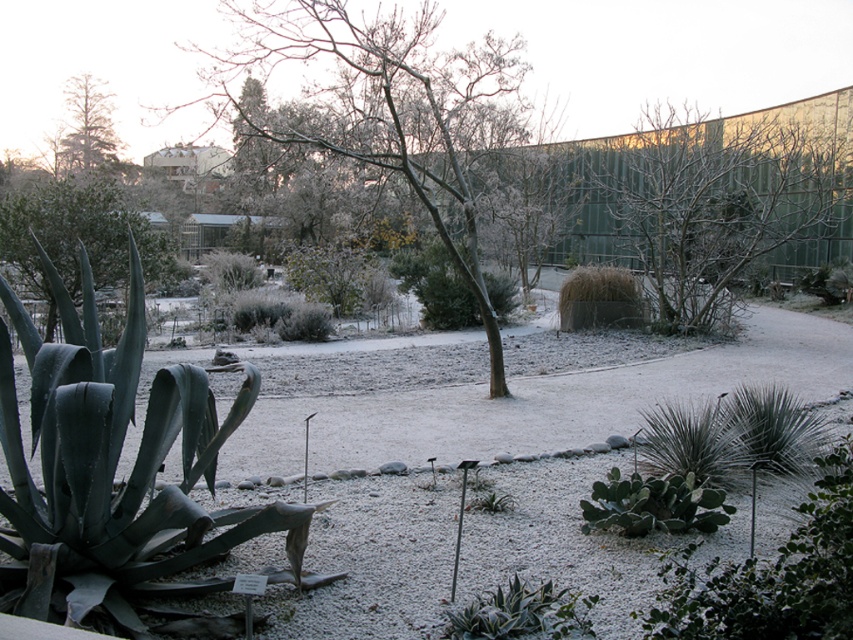
Question: Among these objects, which one is nearest to the camera?

Choices:
 (A) frosted bark tree at center
 (B) bare branches at center

Answer: (A)

Question: Does frosted bark tree at center appear on the right side of green matte tree at upper left?

Choices:
 (A) no
 (B) yes

Answer: (B)

Question: Which of the following is the closest to the observer?

Choices:
 (A) (113, 134)
 (B) (695, 230)
 (C) (488, 332)

Answer: (C)

Question: Which object is the closest to the green matte tree at upper left?

Choices:
 (A) frosted bark tree at center
 (B) bare branches at center

Answer: (A)

Question: Is bare branches at center thinner than green matte tree at upper left?

Choices:
 (A) yes
 (B) no

Answer: (B)

Question: Does frosted bark tree at center lie behind bare branches at center?

Choices:
 (A) no
 (B) yes

Answer: (A)